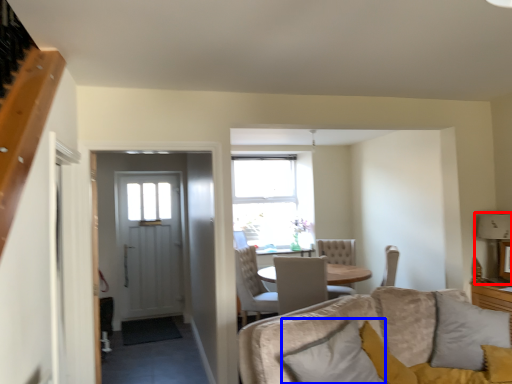
Question: Which object appears farthest to the camera in this image, lamp (highlighted by a red box) or pillow (highlighted by a blue box)?

Choices:
 (A) lamp
 (B) pillow

Answer: (A)